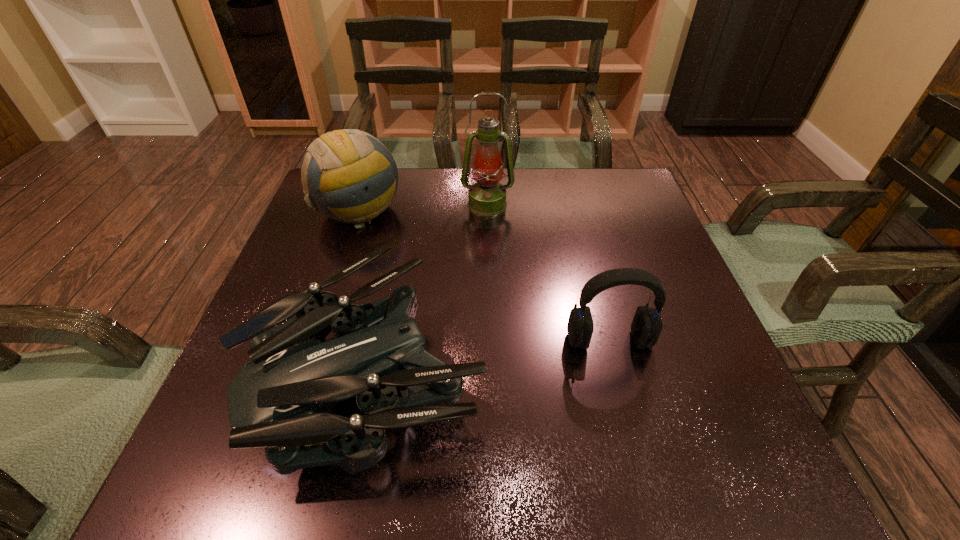
Identify the location of vacant space in between the third shortest object and the headset. The image size is (960, 540). (484, 275).

The width and height of the screenshot is (960, 540). Identify the location of object identified as the closest to the third shortest object. (487, 197).

You are a GUI agent. You are given a task and a screenshot of the screen. Output one action in this format:
    pyautogui.click(x=<x>, y=<y>)
    Task: Click on the second closest object to the drone
    This screenshot has height=540, width=960.
    Given the screenshot: What is the action you would take?
    [x=348, y=175]